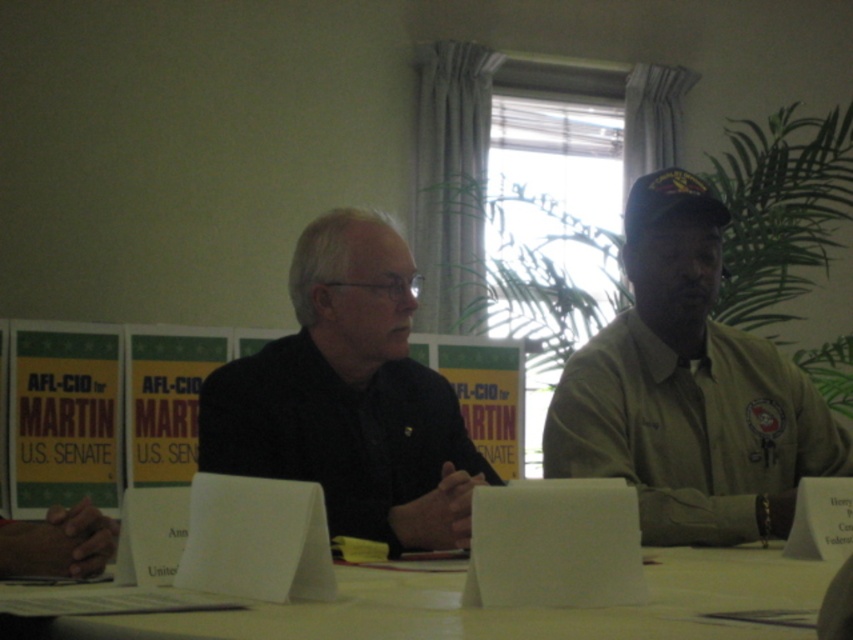
You are organizing a presentation and need to place both the khaki uniform at center and the white paper at center on a narrow table. Considering their sizes, which item should you place first to ensure both fit on the table?

The khaki uniform at center has a lesser width compared to the white paper at center, so you should place the white paper at center first to ensure both fit on the table.

You are standing at the point labeled as point [688,545] in the image. If you want to move to the window covered by sheer curtains, which direction should you walk?

Since the window is near the potted plant and the potted plant is near the window, you should walk towards the window covered by sheer curtains in the direction of the potted plant.